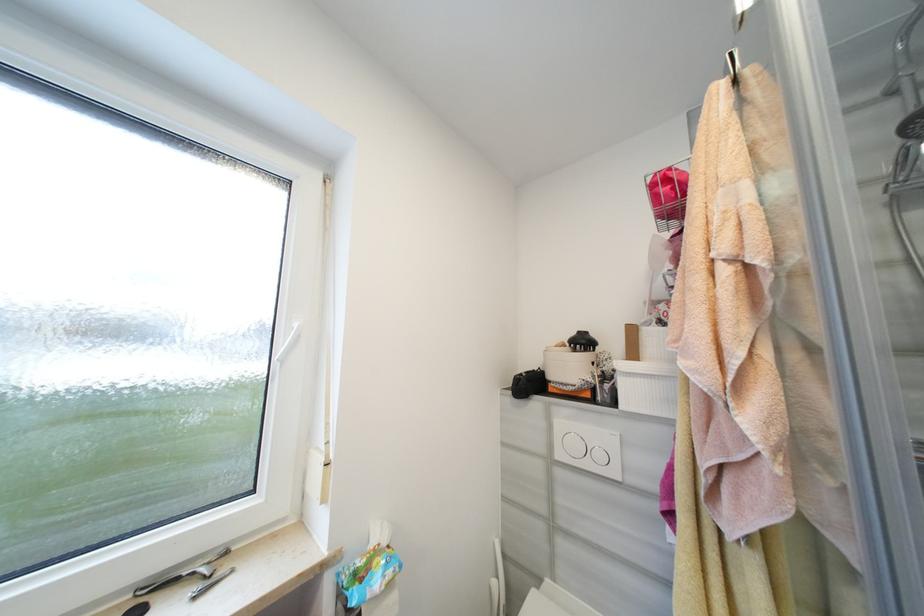
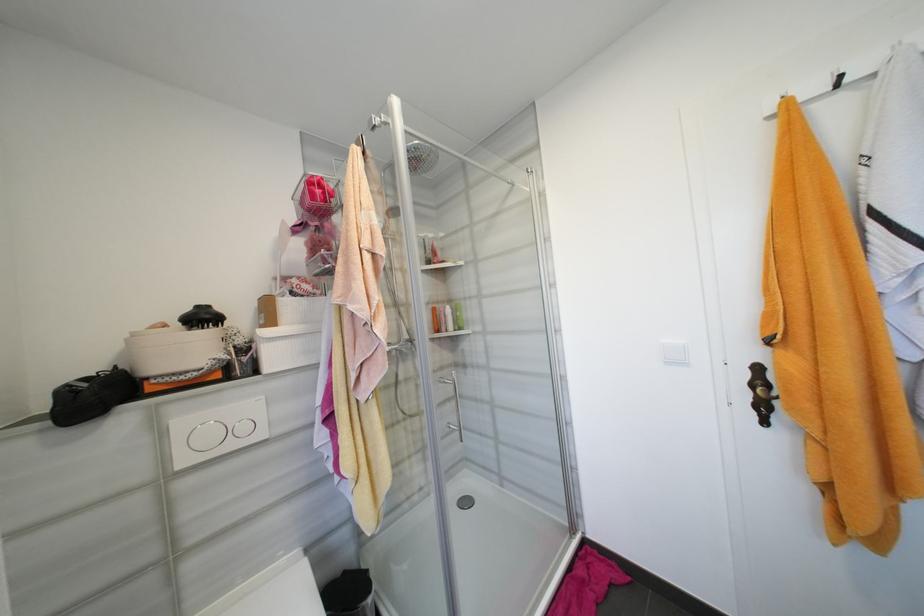
In the second image, find the point that corresponds to pixel 618 378 in the first image.

(256, 349)